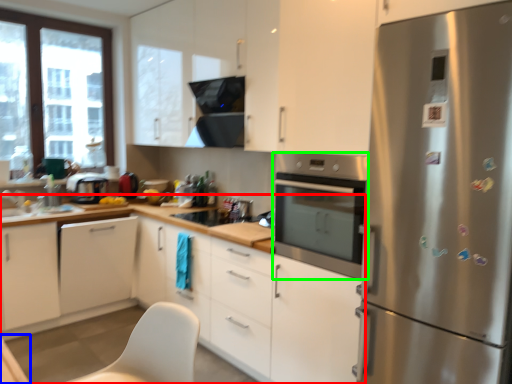
Question: Which is nearer to the cabinetry (highlighted by a red box)? table (highlighted by a blue box) or home appliance (highlighted by a green box).

Choices:
 (A) table
 (B) home appliance

Answer: (B)